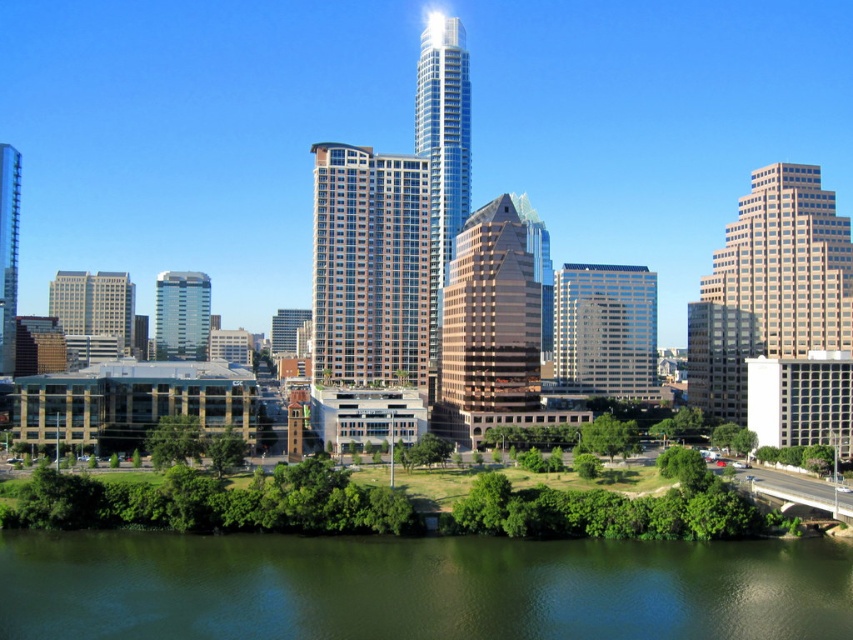
Question: Estimate the real-world distances between objects in this image. Which object is closer to the gray concrete building at left?

Choices:
 (A) green water at lower center
 (B) glassy steel skyscraper at center

Answer: (B)

Question: Can you confirm if white glass building at center is wider than glassy steel skyscraper at center?

Choices:
 (A) yes
 (B) no

Answer: (A)

Question: Estimate the real-world distances between objects in this image. Which object is closer to the gray concrete building at left?

Choices:
 (A) shiny glass skyscraper at center
 (B) green water at lower center

Answer: (A)

Question: Is gray concrete building at left wider than shiny glass skyscraper at center?

Choices:
 (A) no
 (B) yes

Answer: (B)

Question: Which point is closer to the camera taking this photo?

Choices:
 (A) (16, 289)
 (B) (454, 64)
 (C) (173, 285)

Answer: (B)

Question: Considering the relative positions of green water at lower center and matte glass building at center in the image provided, where is green water at lower center located with respect to matte glass building at center?

Choices:
 (A) left
 (B) right

Answer: (B)